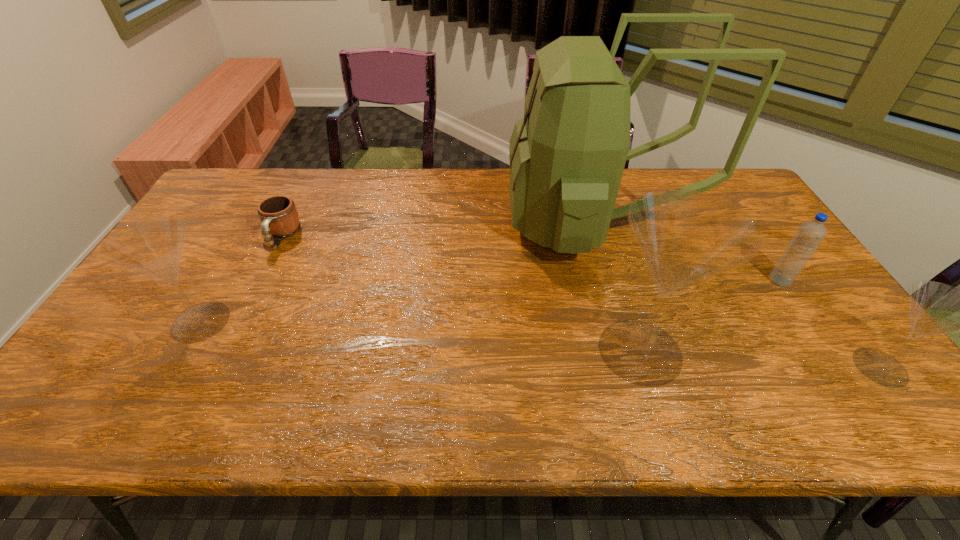
You are a GUI agent. You are given a task and a screenshot of the screen. Output one action in this format:
    pyautogui.click(x=<x>, y=<y>)
    Task: Click on the second shortest flute glass
    This screenshot has width=960, height=540.
    Given the screenshot: What is the action you would take?
    pyautogui.click(x=153, y=246)

Where is `the leftmost flute glass`? the leftmost flute glass is located at coordinates (153, 246).

You are a GUI agent. You are given a task and a screenshot of the screen. Output one action in this format:
    pyautogui.click(x=<x>, y=<y>)
    Task: Click on the second flute glass from left to right
    The width and height of the screenshot is (960, 540).
    Given the screenshot: What is the action you would take?
    pyautogui.click(x=685, y=236)

This screenshot has height=540, width=960. In order to click on the second tallest object in this screenshot , I will do `click(685, 236)`.

I want to click on the shortest flute glass, so click(x=935, y=308).

The width and height of the screenshot is (960, 540). Identify the location of the rightmost object. (935, 308).

Locate an element on the screen. mug is located at coordinates (279, 217).

Locate an element on the screen. the tallest object is located at coordinates (567, 155).

At what (x,y) coordinates should I click in order to perform the action: click on the fifth object from left to right. Please return your answer as a coordinate pair (x, y). The image size is (960, 540). Looking at the image, I should click on (810, 234).

What are the coordinates of `the third farthest object` in the screenshot? It's located at click(810, 234).